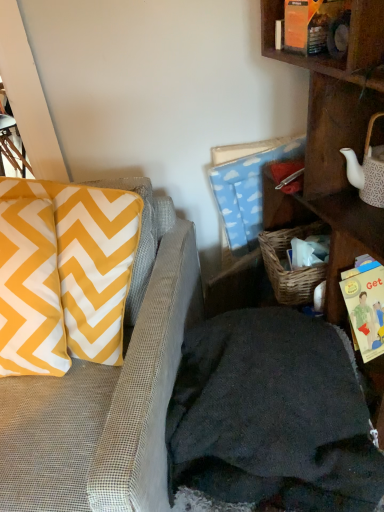
Question: Are yellow/white chevron pillow at left and wooden shelf at right far apart?

Choices:
 (A) yes
 (B) no

Answer: (B)

Question: Could you tell me if yellow/white chevron pillow at left is facing wooden shelf at right?

Choices:
 (A) no
 (B) yes

Answer: (A)

Question: Would you say yellow/white chevron pillow at left is outside wooden shelf at right?

Choices:
 (A) yes
 (B) no

Answer: (A)

Question: Is the depth of yellow/white chevron pillow at left greater than that of wooden shelf at right?

Choices:
 (A) yes
 (B) no

Answer: (A)

Question: From the image's perspective, does yellow/white chevron pillow at left appear lower than wooden shelf at right?

Choices:
 (A) yes
 (B) no

Answer: (A)

Question: Is point (349, 283) positioned closer to the camera than point (336, 192)?

Choices:
 (A) farther
 (B) closer

Answer: (B)

Question: Do you think yellow paper book at right is within wooden shelf at right, or outside of it?

Choices:
 (A) outside
 (B) inside

Answer: (B)

Question: From the image's perspective, is yellow paper book at right positioned above or below wooden shelf at right?

Choices:
 (A) below
 (B) above

Answer: (A)

Question: Considering the positions of yellow paper book at right and wooden shelf at right in the image, is yellow paper book at right taller or shorter than wooden shelf at right?

Choices:
 (A) tall
 (B) short

Answer: (B)

Question: Considering their positions, is yellow paper book at right located in front of or behind textured gray couch at left?

Choices:
 (A) front
 (B) behind

Answer: (B)

Question: Is point (379, 281) positioned closer to the camera than point (170, 369)?

Choices:
 (A) farther
 (B) closer

Answer: (A)

Question: Is yellow paper book at right inside the boundaries of textured gray couch at left, or outside?

Choices:
 (A) outside
 (B) inside

Answer: (A)

Question: Considering the relative positions of yellow paper book at right and textured gray couch at left in the image provided, is yellow paper book at right to the left or to the right of textured gray couch at left?

Choices:
 (A) left
 (B) right

Answer: (B)

Question: Is yellow/white chevron pillow at left bigger or smaller than yellow paper book at right?

Choices:
 (A) small
 (B) big

Answer: (B)

Question: Would you say yellow/white chevron pillow at left is to the left or to the right of yellow paper book at right in the picture?

Choices:
 (A) right
 (B) left

Answer: (B)